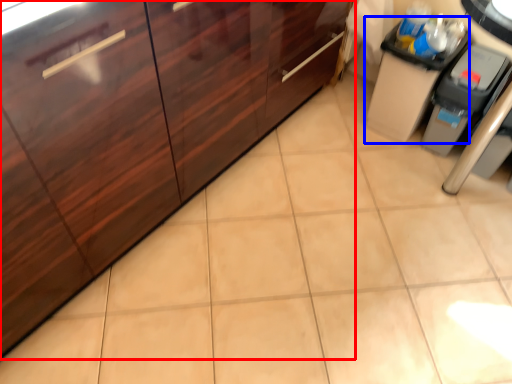
Question: Which object is further to the camera taking this photo, cabinetry (highlighted by a red box) or cabinetry (highlighted by a blue box)?

Choices:
 (A) cabinetry
 (B) cabinetry

Answer: (B)